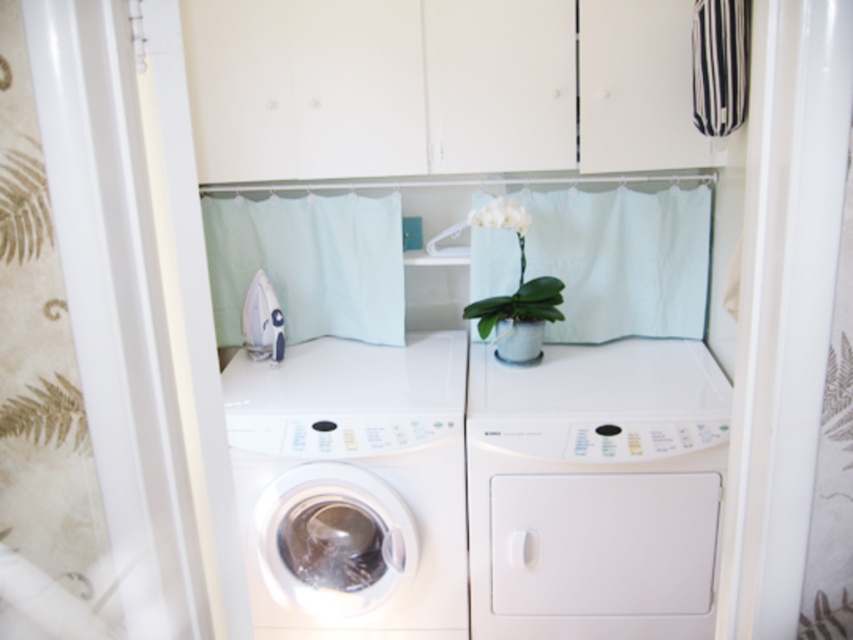
You are trying to locate the light blue fabric at center in the laundry area. Based on the scene description, where would you find it?

The light blue fabric at center is located at point [621,260].

You are organizing the laundry room and need to place a new shelf between the light blue fabric curtain at center and the matte white vase at center. Can the shelf be placed above the vase?

The light blue fabric curtain at center is above the matte white vase at center, so yes, the shelf can be placed above the vase since the curtain is already positioned there.

What object is located at the coordinates point (518,340) in the scene?

The point (518,340) corresponds to the matte white vase at center.